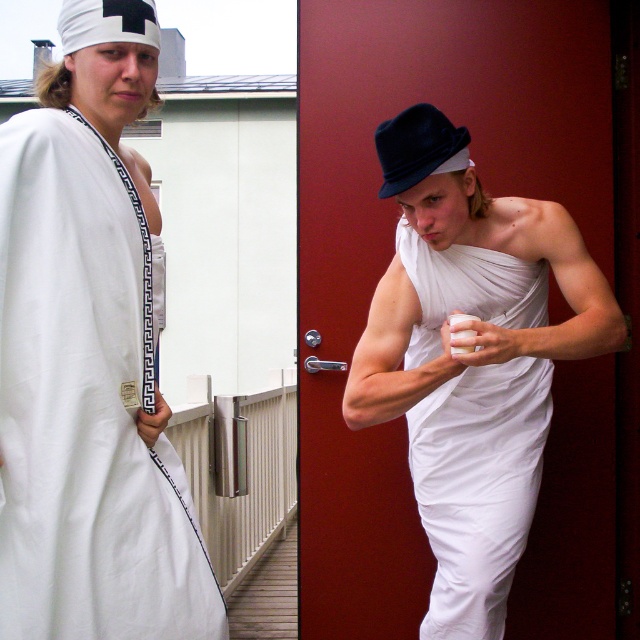
Question: Which object is farther from the camera taking this photo?

Choices:
 (A) navy blue felt hat at upper center
 (B) white cloth at left
 (C) white fabric toga at center

Answer: (A)

Question: Which of the following is the farthest from the observer?

Choices:
 (A) (428, 106)
 (B) (122, 404)
 (C) (525, 442)

Answer: (C)

Question: Does white fabric toga at center have a lesser width compared to white fabric headband at upper left?

Choices:
 (A) yes
 (B) no

Answer: (B)

Question: Can you confirm if white fabric toga at center is positioned below white draped cloth at center?

Choices:
 (A) yes
 (B) no

Answer: (B)

Question: Which of these objects is positioned farthest from the white fabric headband at upper left?

Choices:
 (A) navy blue felt hat at upper center
 (B) white fabric toga at center
 (C) white draped cloth at center

Answer: (C)

Question: Is white cloth at left further to camera compared to navy blue felt hat at upper center?

Choices:
 (A) yes
 (B) no

Answer: (B)